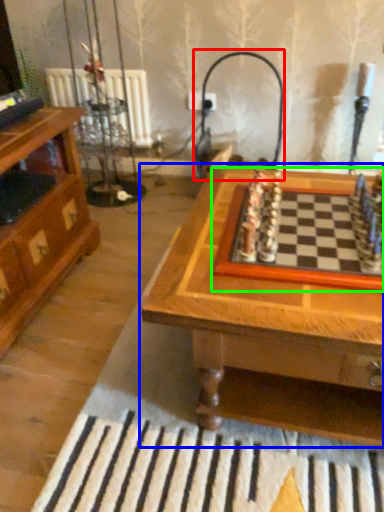
Question: Based on their relative distances, which object is farther from lamp (highlighted by a red box)? Choose from table (highlighted by a blue box) and board game (highlighted by a green box).

Choices:
 (A) table
 (B) board game

Answer: (A)